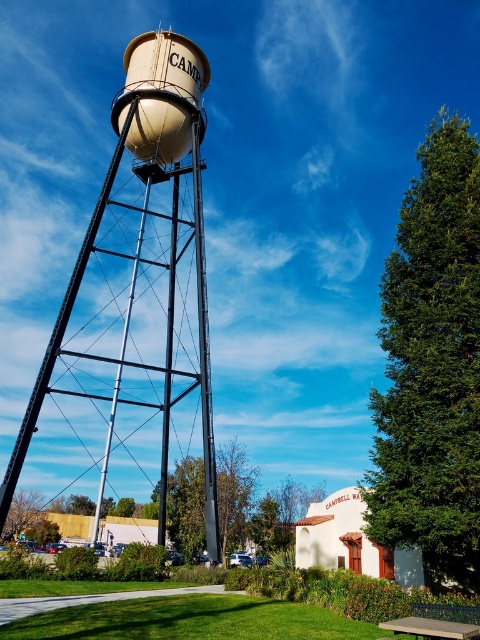
Question: Which object is the closest to the concrete bench at lower right?

Choices:
 (A) matte beige water tower at center
 (B) beige matte water tower at upper center

Answer: (B)

Question: Which point is farther to the camera?

Choices:
 (A) (106, 250)
 (B) (147, 42)
 (C) (469, 618)

Answer: (A)

Question: Is matte beige water tower at center to the left of concrete bench at lower right from the viewer's perspective?

Choices:
 (A) no
 (B) yes

Answer: (B)

Question: Which is farther from the beige matte water tower at upper center?

Choices:
 (A) concrete bench at lower right
 (B) matte beige water tower at center

Answer: (A)

Question: Is matte beige water tower at center smaller than beige matte water tower at upper center?

Choices:
 (A) yes
 (B) no

Answer: (B)

Question: Can you confirm if beige matte water tower at upper center is bigger than concrete bench at lower right?

Choices:
 (A) yes
 (B) no

Answer: (A)